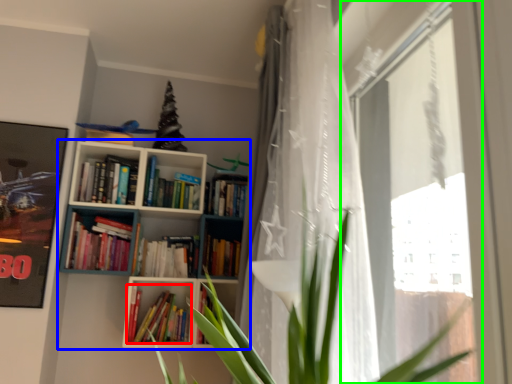
Question: Which is farther away from book (highlighted by a red box)? bookcase (highlighted by a blue box) or window (highlighted by a green box)?

Choices:
 (A) bookcase
 (B) window

Answer: (B)